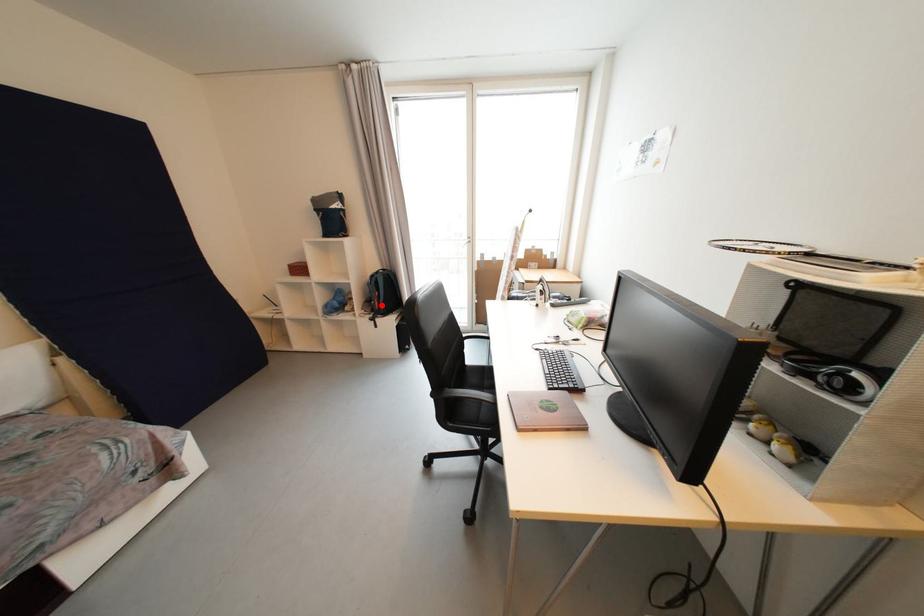
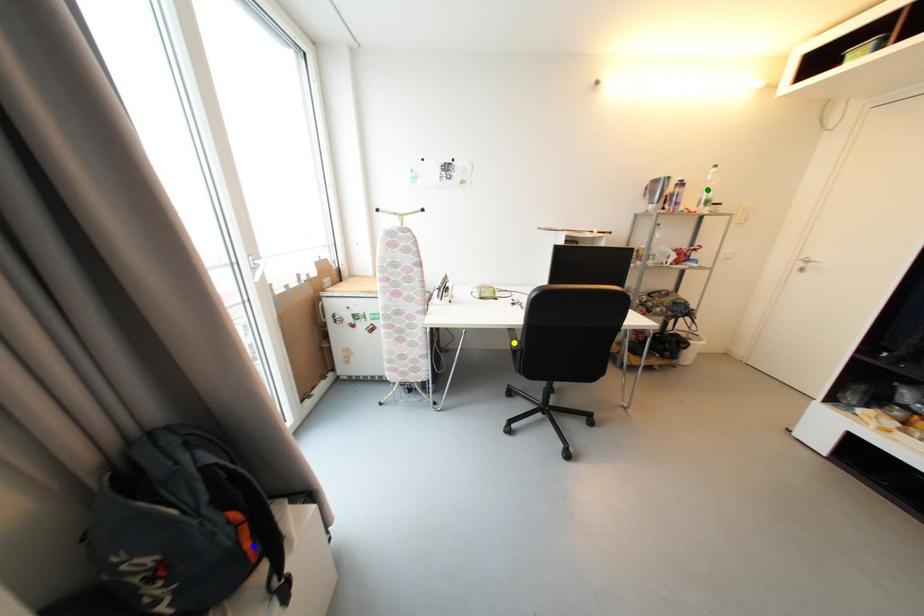
Question: I am providing you with two images of the same scene from different viewpoints. A red point is marked on the first image. You are given multiple points on the second image. Which spot in image 2 lines up with the point in image 1?

Choices:
 (A) yellow point
 (B) blue point
 (C) green point

Answer: (B)